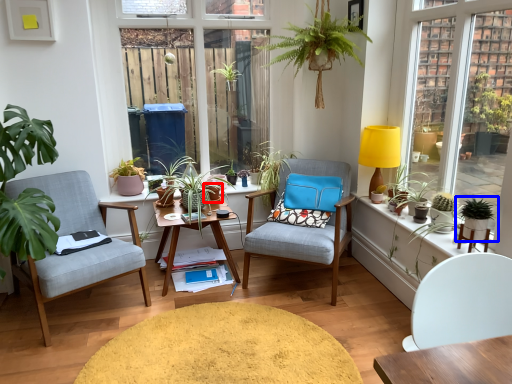
Question: Which of the following is the closest to the observer, flowerpot (highlighted by a red box) or houseplant (highlighted by a blue box)?

Choices:
 (A) flowerpot
 (B) houseplant

Answer: (B)